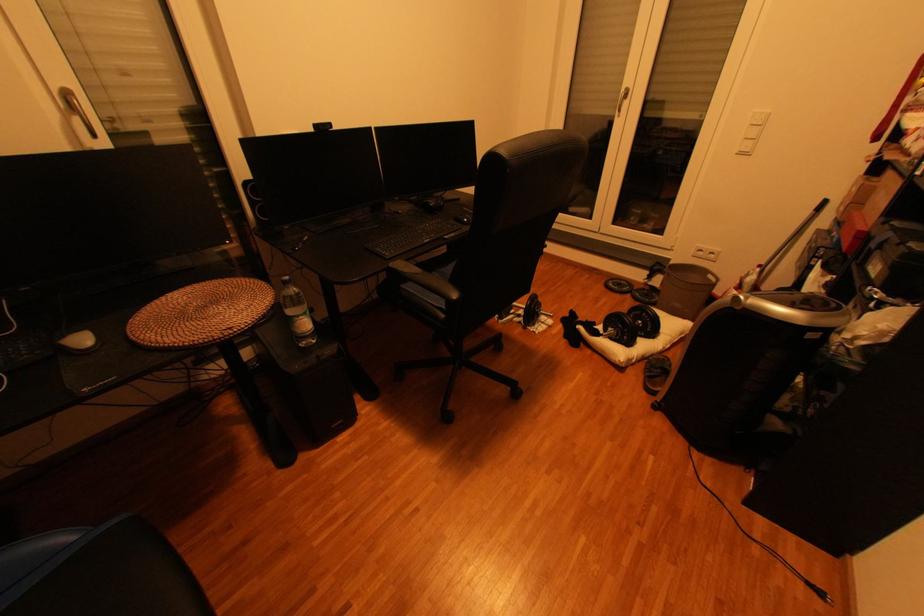
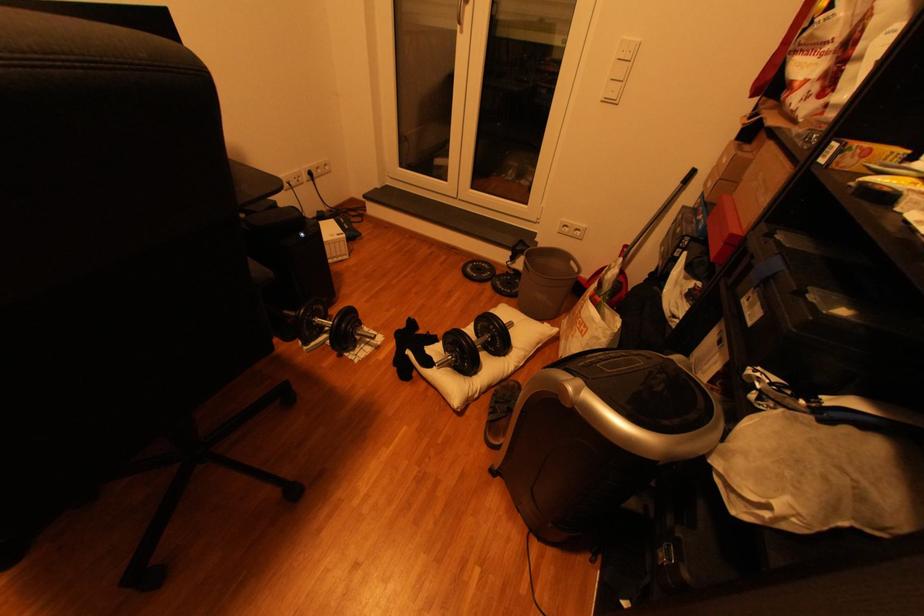
In a continuous first-person perspective shot, in which direction is the camera moving?

The cameraman walked toward right, forward.